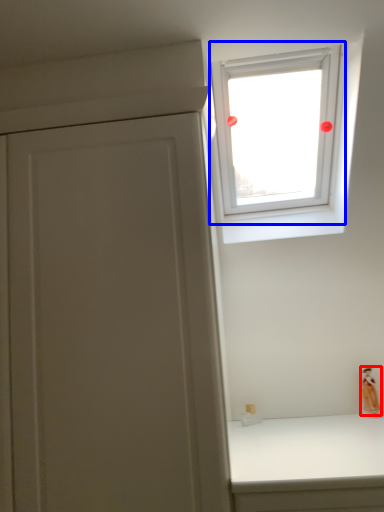
Question: Which of the following is the closest to the observer, figurine (highlighted by a red box) or window (highlighted by a blue box)?

Choices:
 (A) figurine
 (B) window

Answer: (B)